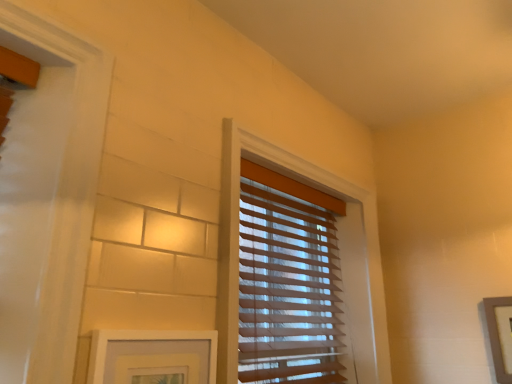
This screenshot has height=384, width=512. Find the location of `translucent wood blinds at center`. translucent wood blinds at center is located at coordinates (288, 281).

How much space does wooden picture frame at right, placed as the first picture frame when sorted from right to left, occupy vertically?

wooden picture frame at right, placed as the first picture frame when sorted from right to left, is 12.72 inches tall.

At what (x,y) coordinates should I click in order to perform the action: click on translucent wood blinds at center. Please return your answer as a coordinate pair (x, y). Image resolution: width=512 pixels, height=384 pixels. Looking at the image, I should click on (288, 281).

In the image, is wooden picture frame at right, which is counted as the second picture frame, starting from the left, on the left side or the right side of translucent wood blinds at center?

In the image, wooden picture frame at right, which is counted as the second picture frame, starting from the left, appears on the right side of translucent wood blinds at center.

At what (x,y) coordinates should I click in order to perform the action: click on window blind that appears above the wooden picture frame at right, which is counted as the second picture frame, starting from the left (from the image's perspective). Please return your answer as a coordinate pair (x, y). The image size is (512, 384). Looking at the image, I should click on (288, 281).

Is wooden picture frame at right, placed as the first picture frame when sorted from right to left, aimed at translucent wood blinds at center?

No, wooden picture frame at right, placed as the first picture frame when sorted from right to left, does not turn towards translucent wood blinds at center.

From the image's perspective, is wooden picture frame at right, which is counted as the second picture frame, starting from the left, located above or below translucent wood blinds at center?

Based on their image positions, wooden picture frame at right, which is counted as the second picture frame, starting from the left, is located beneath translucent wood blinds at center.

From the image's perspective, which object appears higher, white matte picture frame at lower left, the 2th picture frame viewed from the right, or wooden picture frame at right, placed as the first picture frame when sorted from right to left?

white matte picture frame at lower left, the 2th picture frame viewed from the right, is shown above in the image.

Between white matte picture frame at lower left, which appears as the 1th picture frame when viewed from the left, and wooden picture frame at right, which is counted as the first picture frame, starting from the back, which one has larger width?

With larger width is white matte picture frame at lower left, which appears as the 1th picture frame when viewed from the left.

Can you tell me how much white matte picture frame at lower left, which appears as the 1th picture frame when viewed from the left, and wooden picture frame at right, which is counted as the first picture frame, starting from the back, differ in facing direction?

89.1 degrees.

From the image's perspective, is translucent wood blinds at center positioned above or below white matte picture frame at lower left, which appears as the 1th picture frame when viewed from the left?

translucent wood blinds at center is above white matte picture frame at lower left, which appears as the 1th picture frame when viewed from the left.

Would you say translucent wood blinds at center is a long distance from white matte picture frame at lower left, the first picture frame viewed from the front?

No.

Is translucent wood blinds at center in front of or behind white matte picture frame at lower left, the 2th picture frame viewed from the right, in the image?

translucent wood blinds at center is behind white matte picture frame at lower left, the 2th picture frame viewed from the right.

Is white matte picture frame at lower left, the 2th picture frame viewed from the right, positioned far away from translucent wood blinds at center?

No.

Looking at their sizes, would you say white matte picture frame at lower left, the 2th picture frame when ordered from back to front, is wider or thinner than translucent wood blinds at center?

Considering their sizes, white matte picture frame at lower left, the 2th picture frame when ordered from back to front, looks slimmer than translucent wood blinds at center.

The width and height of the screenshot is (512, 384). What are the coordinates of `window blind above the white matte picture frame at lower left, the 2th picture frame when ordered from back to front (from a real-world perspective)` in the screenshot? It's located at (288, 281).

Which is closer to the camera, (183,358) or (281,182)?

Point (183,358) is closer to the camera than point (281,182).

Is wooden picture frame at right, placed as the first picture frame when sorted from right to left, surrounding white matte picture frame at lower left, which appears as the 1th picture frame when viewed from the left?

No, white matte picture frame at lower left, which appears as the 1th picture frame when viewed from the left, is not a part of wooden picture frame at right, placed as the first picture frame when sorted from right to left.

Does wooden picture frame at right, which is counted as the first picture frame, starting from the back, turn towards white matte picture frame at lower left, the 2th picture frame when ordered from back to front?

Yes, wooden picture frame at right, which is counted as the first picture frame, starting from the back, is aimed at white matte picture frame at lower left, the 2th picture frame when ordered from back to front.

Does point (501, 358) appear closer or farther from the camera than point (195, 351)?

Point (501, 358) is farther from the camera than point (195, 351).

Is wooden picture frame at right, which is the 2th picture frame in front-to-back order, located within translucent wood blinds at center?

No, wooden picture frame at right, which is the 2th picture frame in front-to-back order, is not surrounded by translucent wood blinds at center.

From a real-world perspective, is translucent wood blinds at center below wooden picture frame at right, which is the 2th picture frame in front-to-back order?

Incorrect, from a real-world perspective, translucent wood blinds at center is higher than wooden picture frame at right, which is the 2th picture frame in front-to-back order.

From the image's perspective, which one is positioned higher, translucent wood blinds at center or wooden picture frame at right, which is counted as the second picture frame, starting from the left?

translucent wood blinds at center, from the image's perspective.

Does translucent wood blinds at center appear on the right side of wooden picture frame at right, placed as the first picture frame when sorted from right to left?

Incorrect, translucent wood blinds at center is not on the right side of wooden picture frame at right, placed as the first picture frame when sorted from right to left.

Where is `picture frame that appears on the right of translucent wood blinds at center`? picture frame that appears on the right of translucent wood blinds at center is located at coordinates click(x=498, y=336).

Locate an element on the screen. This screenshot has width=512, height=384. picture frame that appears in front of the wooden picture frame at right, which is the 2th picture frame in front-to-back order is located at coordinates (152, 356).

Looking at the image, which one is located further to translucent wood blinds at center, white matte picture frame at lower left, the 2th picture frame viewed from the right, or wooden picture frame at right, which is the 2th picture frame in front-to-back order?

wooden picture frame at right, which is the 2th picture frame in front-to-back order.

From the image, which object appears to be nearer to white matte picture frame at lower left, the 2th picture frame when ordered from back to front, translucent wood blinds at center or wooden picture frame at right, placed as the first picture frame when sorted from right to left?

translucent wood blinds at center is closer to white matte picture frame at lower left, the 2th picture frame when ordered from back to front.

Estimate the real-world distances between objects in this image. Which object is further from white matte picture frame at lower left, the 2th picture frame when ordered from back to front, wooden picture frame at right, placed as the first picture frame when sorted from right to left, or translucent wood blinds at center?

wooden picture frame at right, placed as the first picture frame when sorted from right to left, is further to white matte picture frame at lower left, the 2th picture frame when ordered from back to front.

Considering their positions, is white matte picture frame at lower left, the first picture frame viewed from the front, positioned closer to wooden picture frame at right, which is the 2th picture frame in front-to-back order, than translucent wood blinds at center?

The object closer to wooden picture frame at right, which is the 2th picture frame in front-to-back order, is translucent wood blinds at center.

Estimate the real-world distances between objects in this image. Which object is further from translucent wood blinds at center, wooden picture frame at right, which is the 2th picture frame in front-to-back order, or white matte picture frame at lower left, which appears as the 1th picture frame when viewed from the left?

wooden picture frame at right, which is the 2th picture frame in front-to-back order, is positioned further to the anchor translucent wood blinds at center.

Considering their positions, is translucent wood blinds at center positioned closer to wooden picture frame at right, which is the 2th picture frame in front-to-back order, than white matte picture frame at lower left, the first picture frame viewed from the front?

Among the two, translucent wood blinds at center is located nearer to wooden picture frame at right, which is the 2th picture frame in front-to-back order.

Where is `window blind between white matte picture frame at lower left, the 2th picture frame when ordered from back to front, and wooden picture frame at right, placed as the first picture frame when sorted from right to left`? This screenshot has height=384, width=512. window blind between white matte picture frame at lower left, the 2th picture frame when ordered from back to front, and wooden picture frame at right, placed as the first picture frame when sorted from right to left is located at coordinates (288, 281).